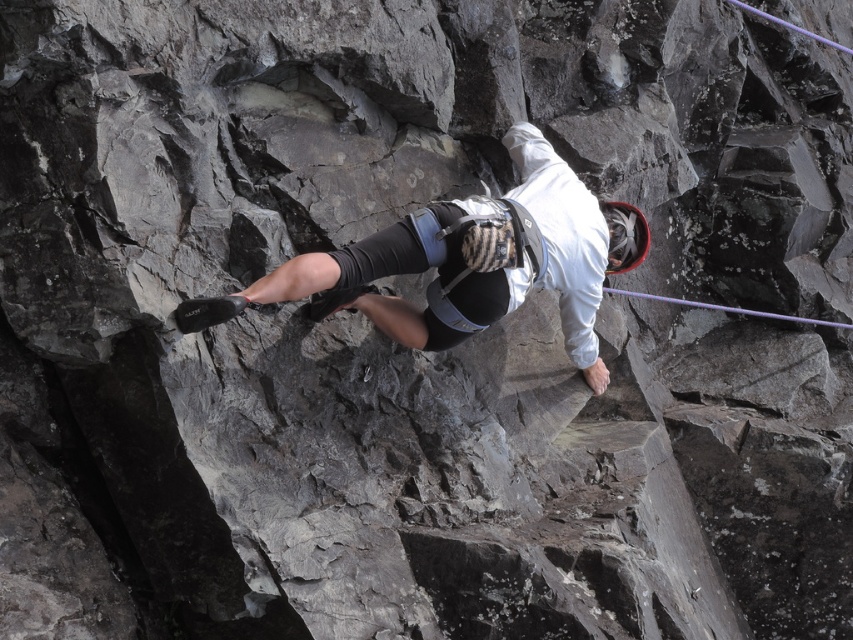
This screenshot has height=640, width=853. Find the location of `white fabric helmet at center`. white fabric helmet at center is located at coordinates (467, 262).

This screenshot has height=640, width=853. Identify the location of white fabric helmet at center. click(x=467, y=262).